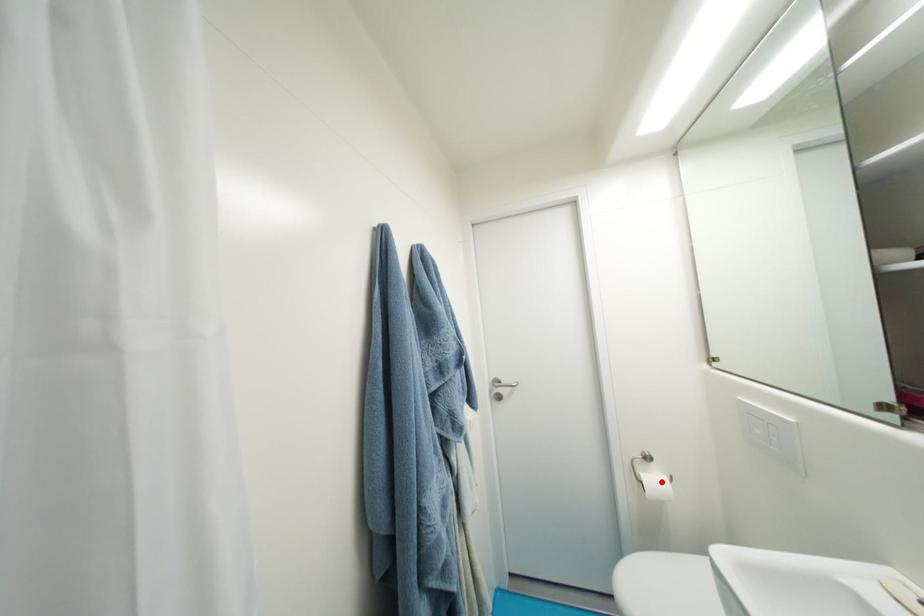
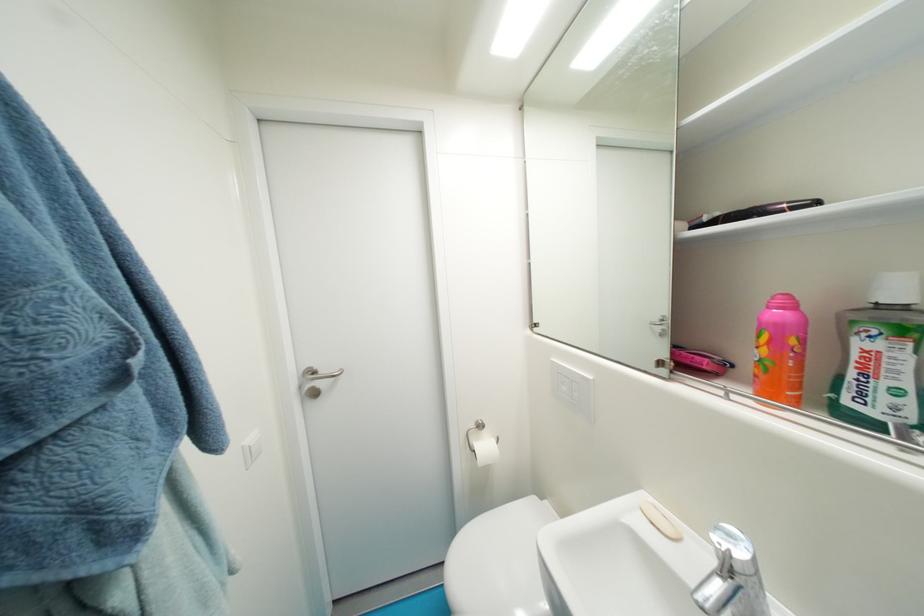
The point at the highlighted location is marked in the first image. Where is the corresponding point in the second image?

(492, 448)